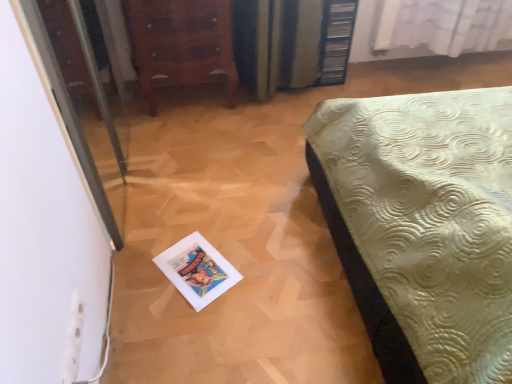
Locate an element on the screen. blank area beneath wooden chest of drawers at upper left (from a real-world perspective) is located at coordinates (193, 104).